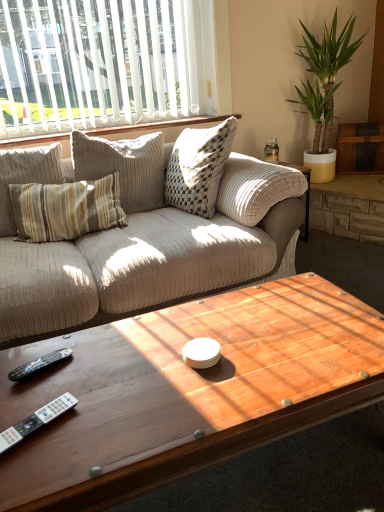
Question: Is white plastic remote at lower left to the left or to the right of green leafy plant at upper right in the image?

Choices:
 (A) right
 (B) left

Answer: (B)

Question: Is white plastic remote at lower left wider or thinner than green leafy plant at upper right?

Choices:
 (A) wide
 (B) thin

Answer: (B)

Question: Which object is positioned farthest from the green leafy plant at upper right?

Choices:
 (A) white vertical blinds at upper left
 (B) wooden coffee table at center
 (C) white textured pillows at upper center
 (D) black plastic remote at lower left
 (E) white plastic remote at lower left

Answer: (E)

Question: Which of these objects is positioned farthest from the white textured pillows at upper center?

Choices:
 (A) white vertical blinds at upper left
 (B) green leafy plant at upper right
 (C) black plastic remote at lower left
 (D) white plastic remote at lower left
 (E) wooden coffee table at center

Answer: (D)